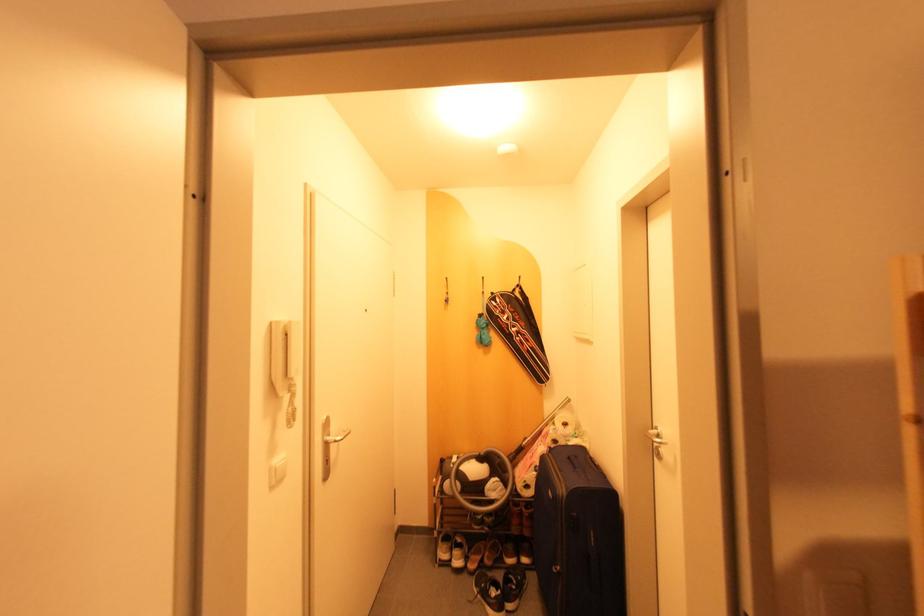
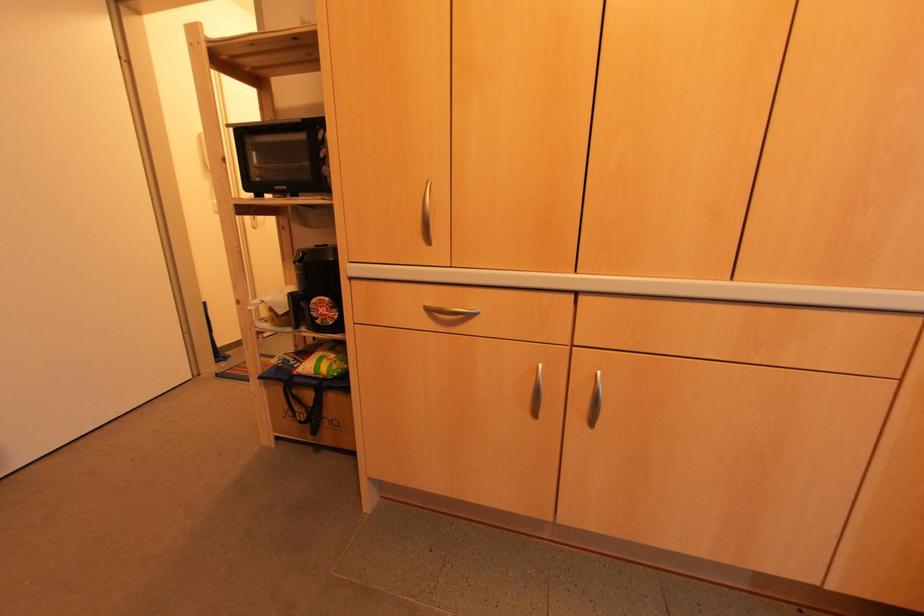
What movement of the cameraman would produce the second image?

The cameraman walked toward right, backward.